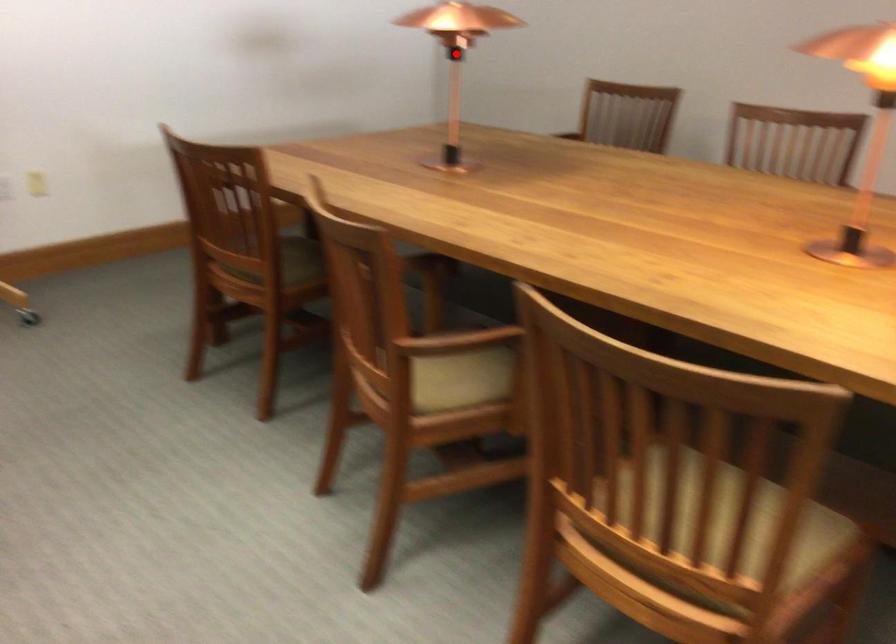
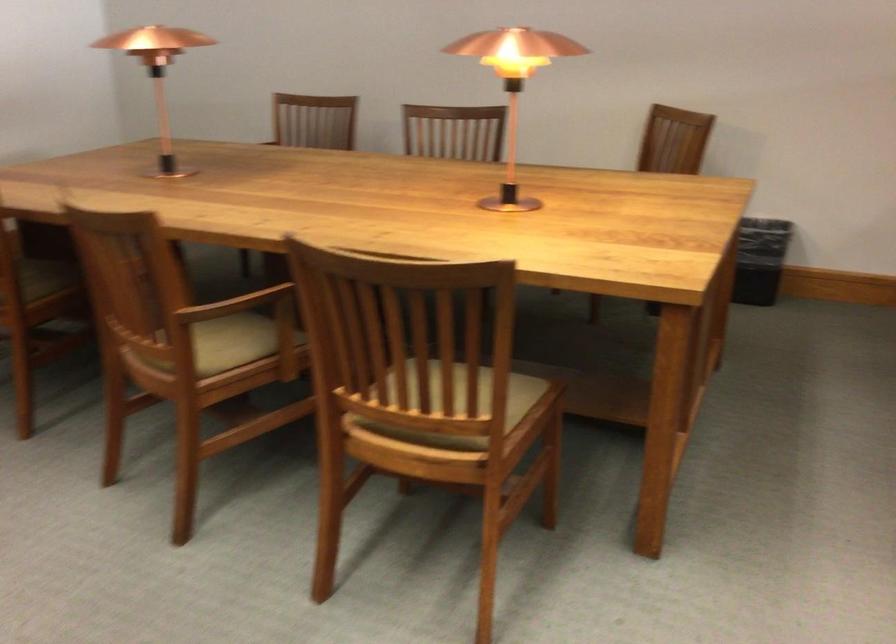
Question: I am providing you with two images of the same scene from different viewpoints. In image1, a red point is highlighted. Considering the same 3D point in image2, which of the following is correct?

Choices:
 (A) It is closer
 (B) It is farther

Answer: (B)